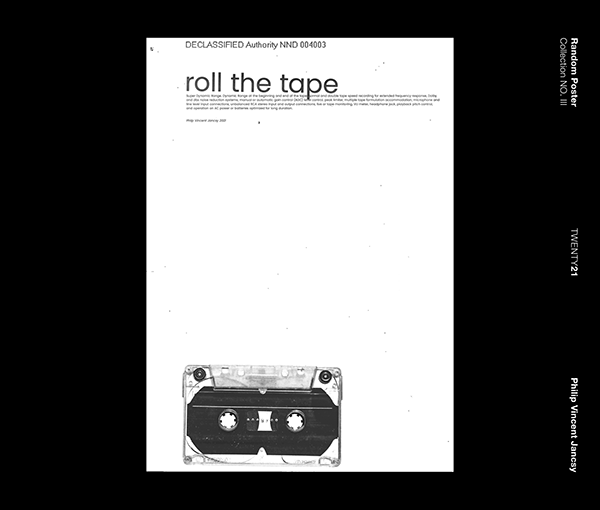
Where is `screws`? The image size is (600, 510). screws is located at coordinates (321, 373), (201, 370), (187, 459), (334, 461).